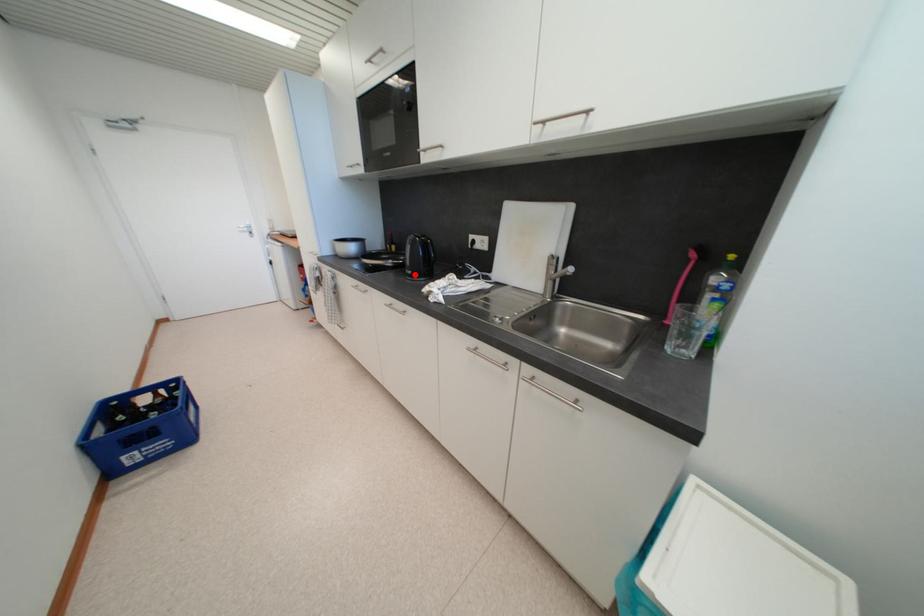
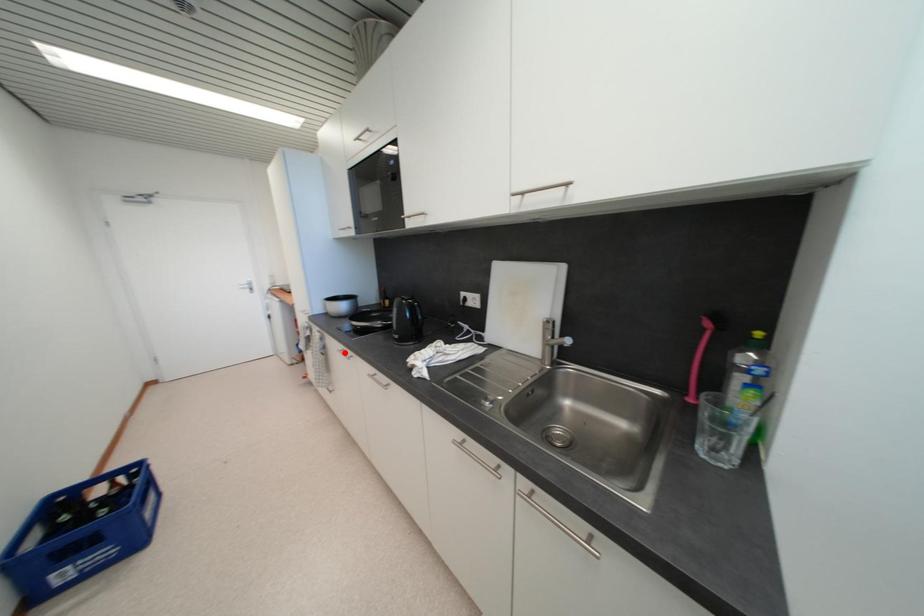
I am providing you with two images of the same scene from different viewpoints. A red point is marked on the first image and another point is marked on the second image. Do the highlighted points in image1 and image2 indicate the same real-world spot?

No